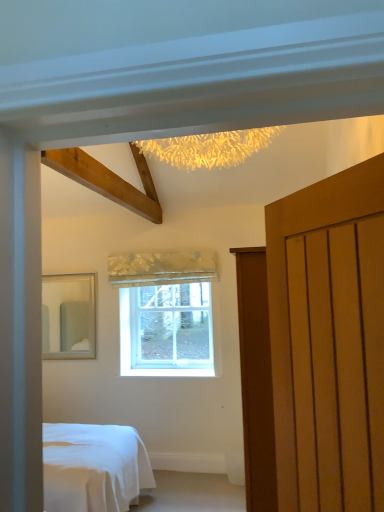
Question: From a real-world perspective, is clear glass window at center positioned under matte silver mirror at left based on gravity?

Choices:
 (A) yes
 (B) no

Answer: (A)

Question: Is clear glass window at center surrounding matte silver mirror at left?

Choices:
 (A) yes
 (B) no

Answer: (B)

Question: Does clear glass window at center touch matte silver mirror at left?

Choices:
 (A) no
 (B) yes

Answer: (A)

Question: Does clear glass window at center have a lesser height compared to matte silver mirror at left?

Choices:
 (A) no
 (B) yes

Answer: (B)

Question: Is clear glass window at center facing towards matte silver mirror at left?

Choices:
 (A) yes
 (B) no

Answer: (B)

Question: Would you say clear glass window at center is inside or outside silky gold curtain at center?

Choices:
 (A) inside
 (B) outside

Answer: (B)

Question: Is point (193, 306) positioned closer to the camera than point (175, 275)?

Choices:
 (A) farther
 (B) closer

Answer: (A)

Question: From the image's perspective, is clear glass window at center positioned above or below silky gold curtain at center?

Choices:
 (A) above
 (B) below

Answer: (B)

Question: Considering the positions of clear glass window at center and silky gold curtain at center in the image, is clear glass window at center wider or thinner than silky gold curtain at center?

Choices:
 (A) wide
 (B) thin

Answer: (B)

Question: Visually, is clear glass window at center positioned to the left or to the right of matte wooden door at right?

Choices:
 (A) right
 (B) left

Answer: (B)

Question: From the image's perspective, relative to matte wooden door at right, is clear glass window at center above or below?

Choices:
 (A) below
 (B) above

Answer: (A)

Question: Is point (160, 306) closer or farther from the camera than point (332, 303)?

Choices:
 (A) closer
 (B) farther

Answer: (B)

Question: Choose the correct answer: Is clear glass window at center inside matte wooden door at right or outside it?

Choices:
 (A) outside
 (B) inside

Answer: (A)

Question: In terms of width, does matte silver mirror at left look wider or thinner when compared to matte wooden door at right?

Choices:
 (A) thin
 (B) wide

Answer: (A)

Question: Considering the positions of matte silver mirror at left and matte wooden door at right in the image, is matte silver mirror at left taller or shorter than matte wooden door at right?

Choices:
 (A) short
 (B) tall

Answer: (A)